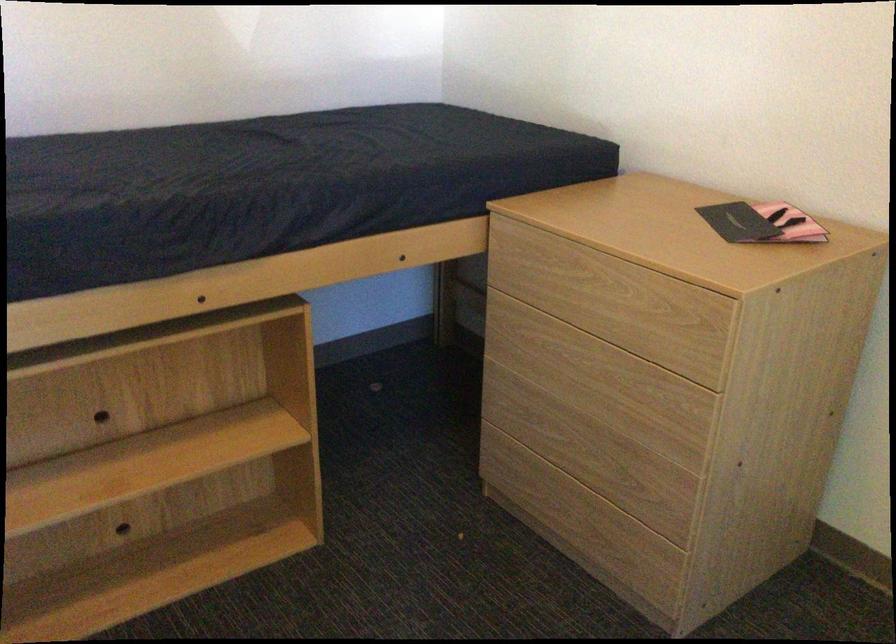
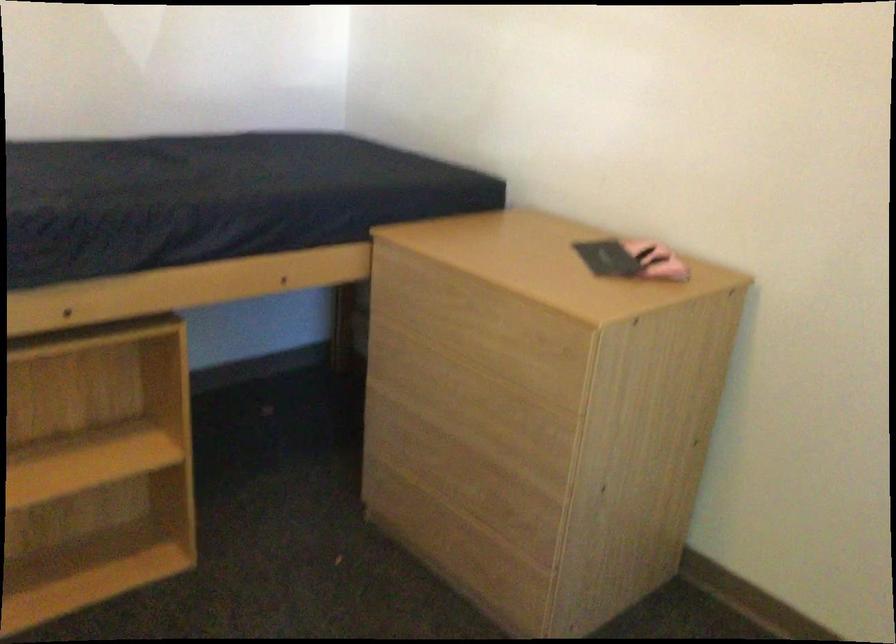
Question: The images are taken continuously from a first-person perspective. In which direction are you moving?

Choices:
 (A) Left
 (B) Right
 (C) Forward
 (D) Backward

Answer: (B)